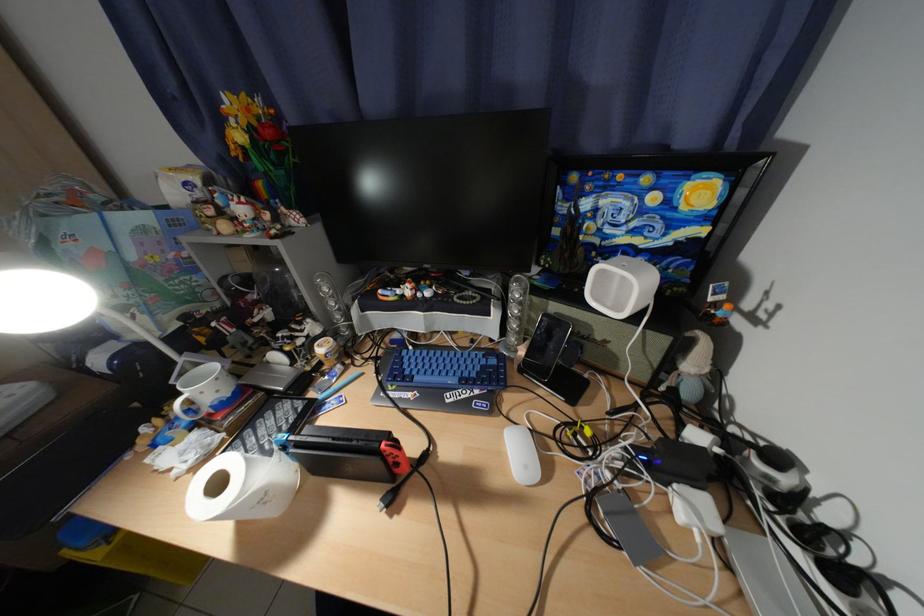
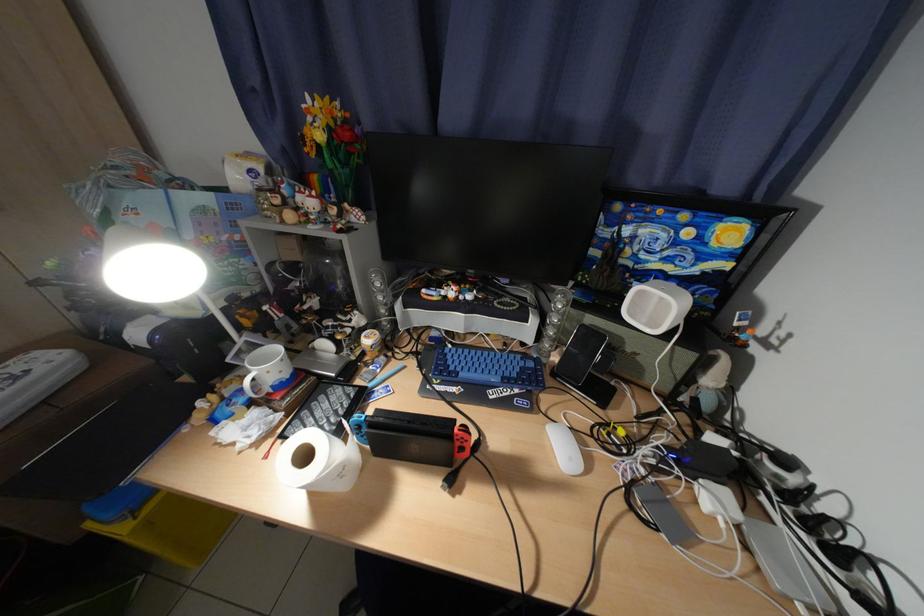
Find the pixel in the second image that matches (x=506, y=337) in the first image.

(541, 342)